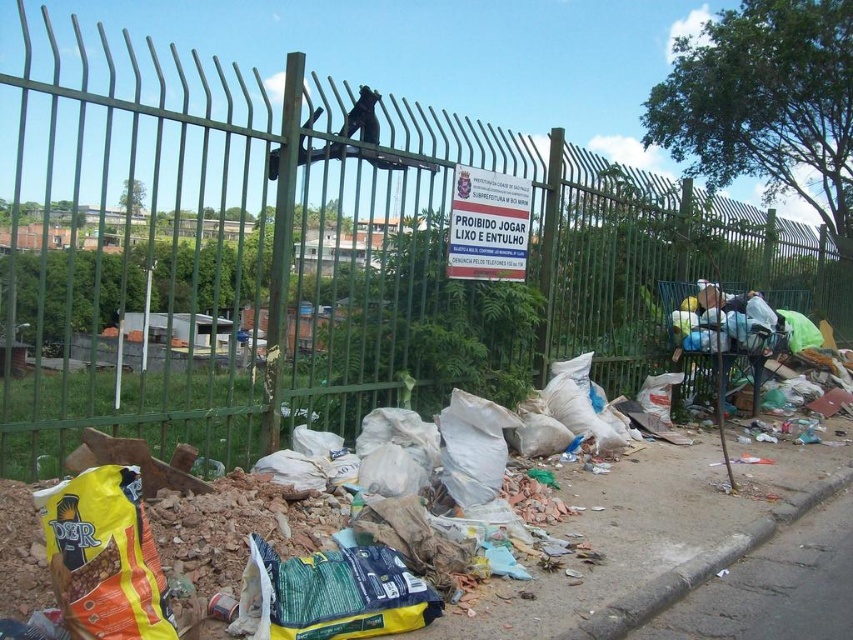
Question: Which of the following is the closest to the observer?

Choices:
 (A) (753, 339)
 (B) (827, 611)

Answer: (B)

Question: Is gray concrete pavement at lower right thinner than dark gray fabric bag at center right?

Choices:
 (A) yes
 (B) no

Answer: (B)

Question: Can you confirm if gray concrete pavement at lower right is positioned below dark gray fabric bag at center right?

Choices:
 (A) no
 (B) yes

Answer: (B)

Question: Does gray concrete pavement at lower right have a greater width compared to dark gray fabric bag at center right?

Choices:
 (A) yes
 (B) no

Answer: (A)

Question: Which point is closer to the camera?

Choices:
 (A) (780, 566)
 (B) (700, 307)

Answer: (A)